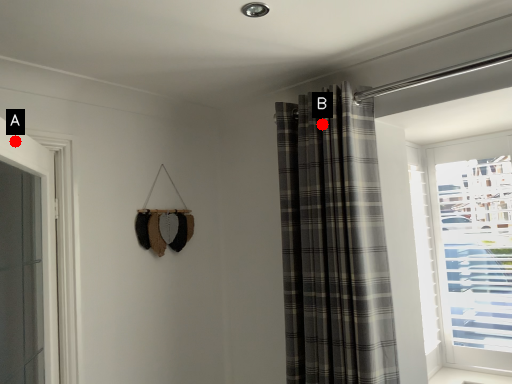
Question: Two points are circled on the image, labeled by A and B beside each circle. Among these points, which one is nearest to the camera?

Choices:
 (A) A is closer
 (B) B is closer

Answer: (A)